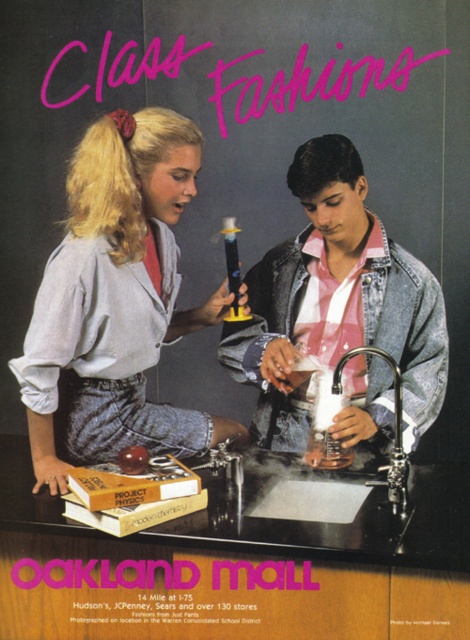
Based on the scene described, which object is positioned higher in the image, the matte blue shirt at center or the polished chrome faucet at lower center?

The matte blue shirt at center is positioned higher than the polished chrome faucet at lower center according to the description.

Looking at this image, you are a photographer standing at the back of the lab. You need to capture a photo where both the matte blue shirt at center and the polished chrome faucet at lower center are clearly visible. Which object will appear larger in the photo?

The matte blue shirt at center will appear larger in the photo because it is taller than the polished chrome faucet at lower center.

In the scene shown: You are standing in front of the Oakland Mall advertisement. There are two points marked on the image. The first point is at coordinates point (x=386, y=273) and the second is at point (x=341, y=378). Which point is closer to you?

Point (x=341, y=378) is closer to you because it is in front of point (x=386, y=273).